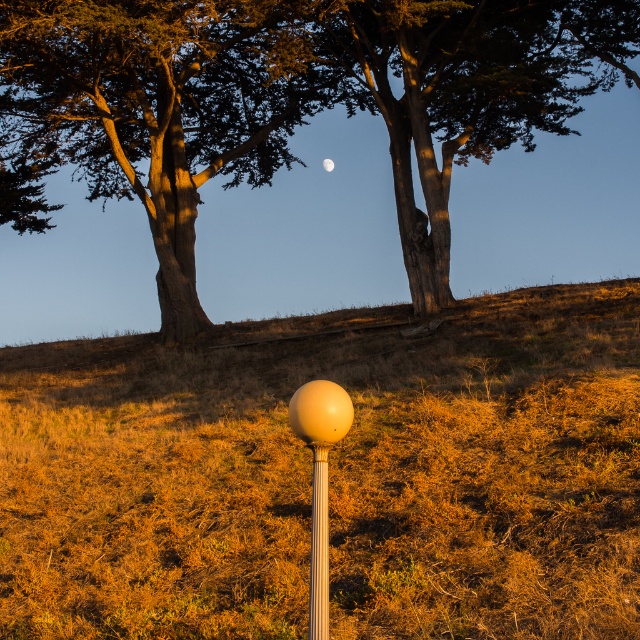
Question: Considering the relative positions of smooth brown tree trunk at upper center and matte beige sphere at center in the image provided, where is smooth brown tree trunk at upper center located with respect to matte beige sphere at center?

Choices:
 (A) above
 (B) below

Answer: (A)

Question: Does metallic silver pole at center appear over white matte moon at upper center?

Choices:
 (A) yes
 (B) no

Answer: (B)

Question: Does smooth brown tree trunk at upper center have a lesser width compared to matte beige sphere at center?

Choices:
 (A) yes
 (B) no

Answer: (B)

Question: Which object appears farthest from the camera in this image?

Choices:
 (A) smooth brown tree trunk at upper center
 (B) matte beige sphere at center
 (C) metallic silver pole at center

Answer: (A)

Question: Which point is farther to the camera?

Choices:
 (A) metallic silver pole at center
 (B) matte yellow grass at center
 (C) smooth brown tree trunk at upper center
 (D) white matte moon at upper center

Answer: (D)

Question: Which point is farther from the camera taking this photo?

Choices:
 (A) (113, 93)
 (B) (326, 545)
 (C) (157, 620)
 (D) (321, 516)

Answer: (A)